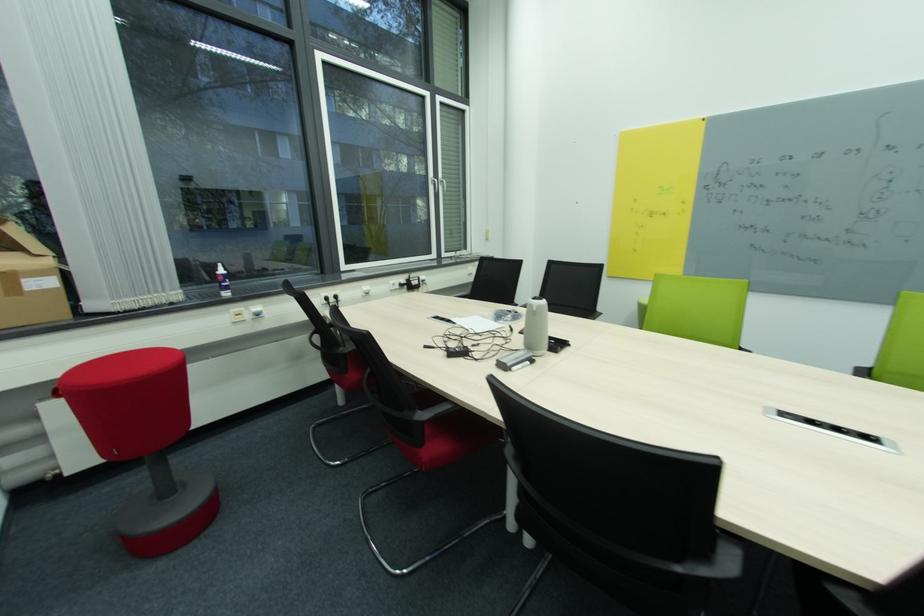
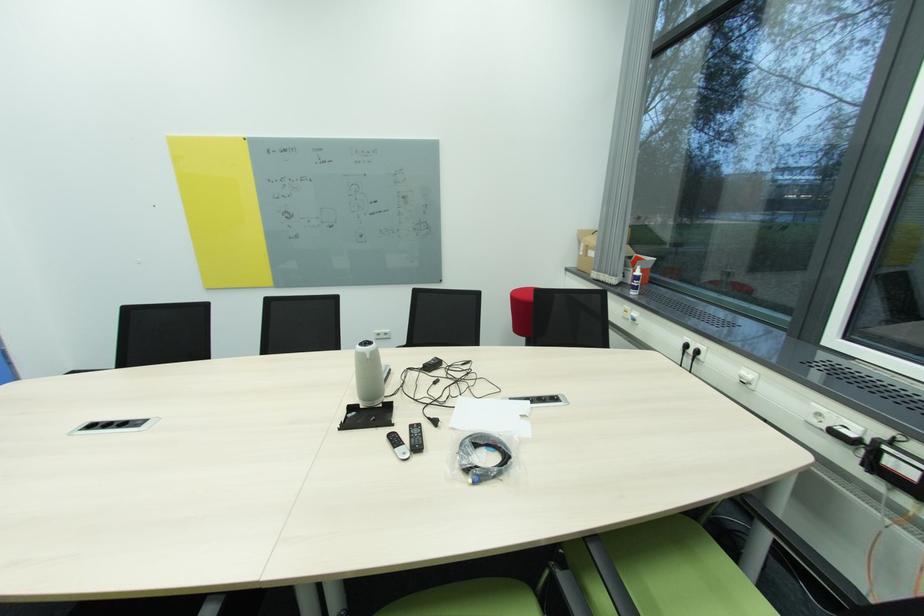
Where in the second image is the point corresponding to point 227,276 from the first image?

(639, 277)